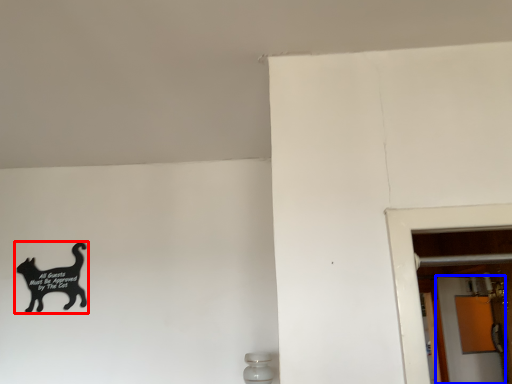
Question: Which object appears farthest to the camera in this image, cat (highlighted by a red box) or screen door (highlighted by a blue box)?

Choices:
 (A) cat
 (B) screen door

Answer: (B)